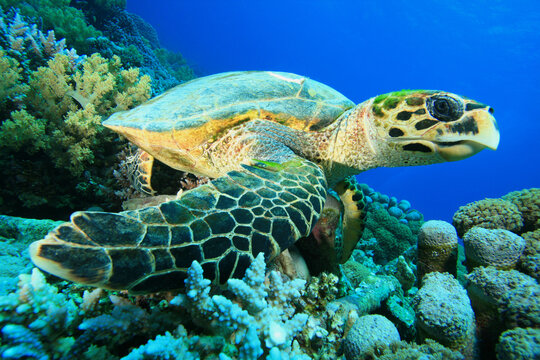
The height and width of the screenshot is (360, 540). I want to click on green plants, so click(33, 140), click(14, 134), click(25, 118), click(17, 81), click(6, 55).